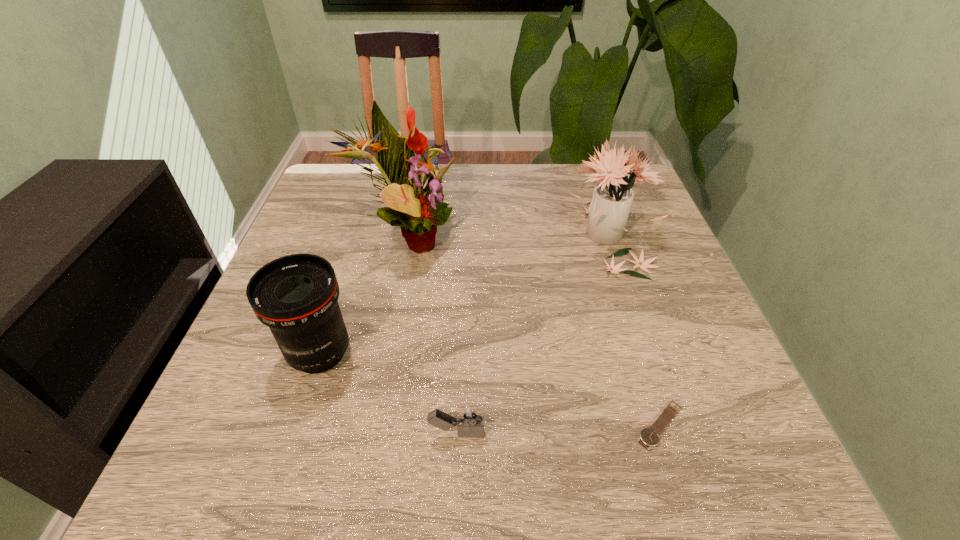
Where is `vacant space located 0.200m on the back of the third tallest object`? The height and width of the screenshot is (540, 960). vacant space located 0.200m on the back of the third tallest object is located at coordinates point(349,260).

This screenshot has width=960, height=540. Identify the location of free space located 0.210m on the right of the fourth tallest object. coord(612,434).

This screenshot has height=540, width=960. Find the location of `free space located 0.370m on the back of the watch`. free space located 0.370m on the back of the watch is located at coordinates (609, 260).

Identify the location of object situated at the far edge. (609, 209).

This screenshot has height=540, width=960. I want to click on igniter that is at the near edge, so click(x=469, y=420).

This screenshot has width=960, height=540. In order to click on watch situated at the near edge in this screenshot , I will do `click(649, 437)`.

Identify the location of bouquet situated at the left edge. Image resolution: width=960 pixels, height=540 pixels. click(417, 211).

You are a GUI agent. You are given a task and a screenshot of the screen. Output one action in this format:
    pyautogui.click(x=<x>, y=<y>)
    Task: Click on the telephoto lens that is at the left edge
    The width and height of the screenshot is (960, 540).
    Given the screenshot: What is the action you would take?
    pyautogui.click(x=296, y=296)

Locate an element on the screen. The width and height of the screenshot is (960, 540). bouquet present at the right edge is located at coordinates (609, 209).

This screenshot has height=540, width=960. In order to click on watch located in the right edge section of the desktop in this screenshot , I will do `click(649, 437)`.